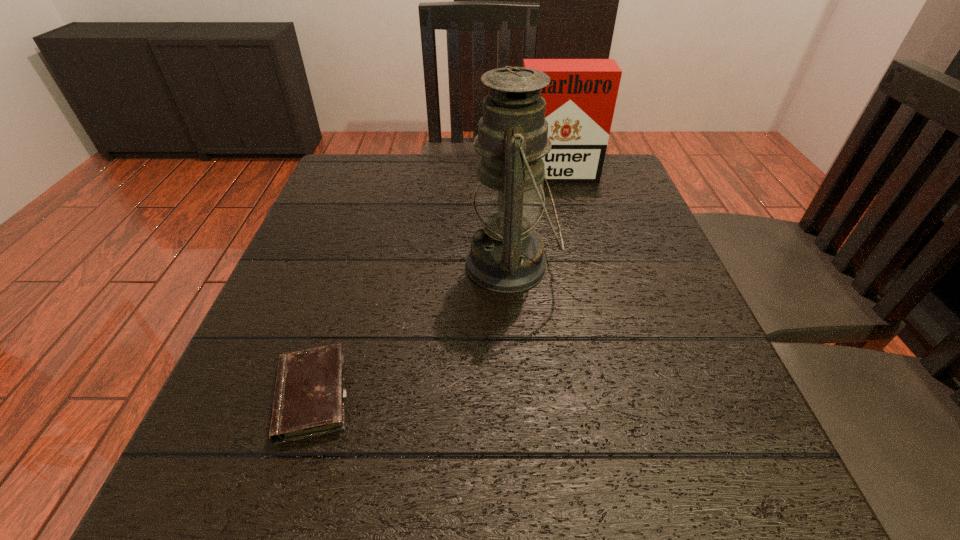
What are the coordinates of `vacant region between the second farthest object and the nearest object` in the screenshot? It's located at (411, 330).

Image resolution: width=960 pixels, height=540 pixels. Identify the location of free space between the oil lamp and the shortest object. (411, 330).

At what (x,y) coordinates should I click in order to perform the action: click on vacant space that is in between the nearest object and the tallest object. Please return your answer as a coordinate pair (x, y). The width and height of the screenshot is (960, 540). Looking at the image, I should click on (411, 330).

Image resolution: width=960 pixels, height=540 pixels. In order to click on object that can be found as the second closest to the nearest object in this screenshot , I will do `click(580, 99)`.

Locate which object ranks in proximity to the farthest object. Please provide its 2D coordinates. Your answer should be formatted as a tuple, i.e. [(x, y)], where the tuple contains the x and y coordinates of a point satisfying the conditions above.

[(506, 255)]

The image size is (960, 540). In order to click on free space that satisfies the following two spatial constraints: 1. on the back side of the oil lamp; 2. on the right side of the nearest object in this screenshot , I will do `click(353, 265)`.

At what (x,y) coordinates should I click in order to perform the action: click on free space that satisfies the following two spatial constraints: 1. on the back side of the leftmost object; 2. on the right side of the oil lamp. Please return your answer as a coordinate pair (x, y). Looking at the image, I should click on (353, 265).

What are the coordinates of `vacant space that satisfies the following two spatial constraints: 1. on the back side of the second nearest object; 2. on the right side of the shortest object` in the screenshot? It's located at (353, 265).